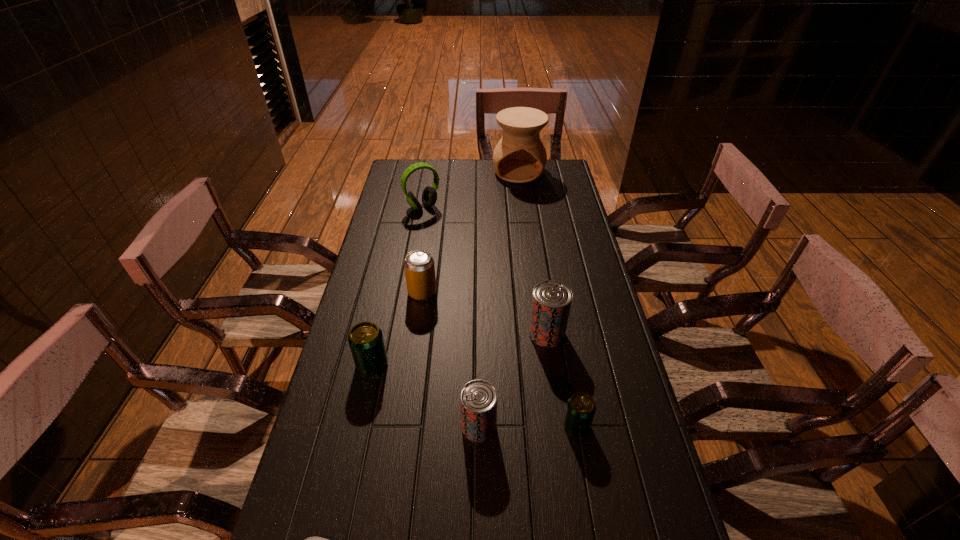
Locate an element on the screen. vacant space that satisfies the following two spatial constraints: 1. on the back side of the third nearest beer can; 2. on the left side of the farthest beer can is located at coordinates (379, 334).